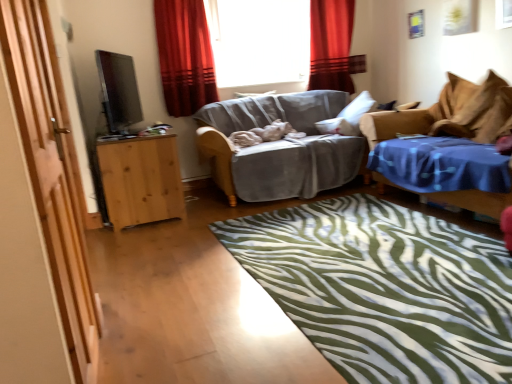
The height and width of the screenshot is (384, 512). Describe the element at coordinates (280, 146) in the screenshot. I see `gray fabric couch at center, positioned as the 1th studio couch in left-to-right order` at that location.

The width and height of the screenshot is (512, 384). What do you see at coordinates (259, 41) in the screenshot?
I see `transparent glass window at center` at bounding box center [259, 41].

Identify the location of blue fabric studio couch at right, which ranks as the second studio couch in left-to-right order. (448, 147).

Describe the element at coordinates (185, 56) in the screenshot. I see `red velvet curtain at upper center, placed as the 1th curtain when sorted from front to back` at that location.

The image size is (512, 384). What do you see at coordinates (141, 180) in the screenshot?
I see `light brown wooden cabinet at left` at bounding box center [141, 180].

The image size is (512, 384). What are the coordinates of `light brown wooden cabinet at left` in the screenshot? It's located at (141, 180).

Find the location of `gray fabric couch at center, which is counted as the 2th studio couch, starting from the right`. gray fabric couch at center, which is counted as the 2th studio couch, starting from the right is located at coordinates (280, 146).

Does point (117, 70) lie behind point (310, 17)?

That is False.

From the image's perspective, is satin black tv at left above red velvet curtain at upper center, acting as the second curtain starting from the left?

No, from the image's perspective, satin black tv at left is not on top of red velvet curtain at upper center, acting as the second curtain starting from the left.

Are satin black tv at left and red velvet curtain at upper center, which is the 1th curtain from back to front, making contact?

No, satin black tv at left is not in contact with red velvet curtain at upper center, which is the 1th curtain from back to front.

Does satin black tv at left have a greater height compared to red velvet curtain at upper center, the 1th curtain positioned from the right?

In fact, satin black tv at left may be shorter than red velvet curtain at upper center, the 1th curtain positioned from the right.

Is red velvet curtain at upper center, placed as the 1th curtain when sorted from front to back, not close to blue fabric studio couch at right, which ranks as the second studio couch in left-to-right order?

Yes.

The image size is (512, 384). I want to click on the 2nd curtain positioned above the blue fabric studio couch at right, which ranks as the second studio couch in left-to-right order (from a real-world perspective), so click(x=185, y=56).

Is point (208, 103) less distant than point (376, 156)?

That is False.

Is the position of red velvet curtain at upper center, placed as the 1th curtain when sorted from front to back, less distant than that of blue fabric studio couch at right, the 1th studio couch from the right?

No, red velvet curtain at upper center, placed as the 1th curtain when sorted from front to back, is further to the viewer.

Which object is further away from the camera taking this photo, satin black tv at left or green zebra-patterned rug at center?

satin black tv at left is further away from the camera.

Is there a large distance between satin black tv at left and green zebra-patterned rug at center?

Absolutely, satin black tv at left is distant from green zebra-patterned rug at center.

Based on the photo, is satin black tv at left turned away from green zebra-patterned rug at center?

satin black tv at left does not have its back to green zebra-patterned rug at center.

Considering the sizes of objects satin black tv at left and green zebra-patterned rug at center in the image provided, who is wider, satin black tv at left or green zebra-patterned rug at center?

green zebra-patterned rug at center is wider.

Would you say light brown wooden cabinet at left is inside or outside satin black tv at left?

light brown wooden cabinet at left is spatially situated outside satin black tv at left.

From a real-world perspective, which is physically above, light brown wooden cabinet at left or satin black tv at left?

satin black tv at left is physically above.

Is point (117, 167) closer or farther from the camera than point (118, 56)?

Clearly, point (117, 167) is closer to the camera than point (118, 56).

Measure the distance between light brown wooden cabinet at left and satin black tv at left.

They are 3.75 feet apart.

Is blue fabric studio couch at right, the 1th studio couch from the right, with light brown wooden cabinet at left?

No, blue fabric studio couch at right, the 1th studio couch from the right, is not touching light brown wooden cabinet at left.

Considering the relative sizes of blue fabric studio couch at right, the 1th studio couch from the right, and light brown wooden cabinet at left in the image provided, is blue fabric studio couch at right, the 1th studio couch from the right, thinner than light brown wooden cabinet at left?

No, blue fabric studio couch at right, the 1th studio couch from the right, is not thinner than light brown wooden cabinet at left.

How different are the orientations of blue fabric studio couch at right, the 1th studio couch from the right, and light brown wooden cabinet at left in degrees?

The angular difference between blue fabric studio couch at right, the 1th studio couch from the right, and light brown wooden cabinet at left is 180 degrees.

Measure the distance between blue fabric studio couch at right, the 1th studio couch from the right, and light brown wooden cabinet at left.

6.86 feet.

Looking at this image, between wooden door at left and transparent glass window at center, which one has less height?

transparent glass window at center is shorter.

From the image's perspective, between wooden door at left and transparent glass window at center, which one is located above?

transparent glass window at center appears higher in the image.

Between wooden door at left and transparent glass window at center, which one appears on the left side from the viewer's perspective?

wooden door at left is more to the left.

What's the angular difference between wooden door at left and transparent glass window at center's facing directions?

They differ by 89.8 degrees in their facing directions.

Which studio couch is the 1st one when counting from the front of the red velvet curtain at upper center, positioned as the 2th curtain in front-to-back order? Please provide its 2D coordinates.

[(280, 146)]

Based on the photo, does red velvet curtain at upper center, which is the 1th curtain from back to front, come in front of gray fabric couch at center, positioned as the 1th studio couch in left-to-right order?

No.

Considering the positions of objects red velvet curtain at upper center, the 1th curtain positioned from the right, and gray fabric couch at center, which is counted as the 2th studio couch, starting from the right, in the image provided, who is more to the left, red velvet curtain at upper center, the 1th curtain positioned from the right, or gray fabric couch at center, which is counted as the 2th studio couch, starting from the right,?

gray fabric couch at center, which is counted as the 2th studio couch, starting from the right.

In order to click on open located below the red velvet curtain at upper center, the 1th curtain positioned from the right (from the image's perspective) in this screenshot , I will do `click(118, 91)`.

The image size is (512, 384). Find the location of `curtain that is the 1st one when counting backward from the blue fabric studio couch at right, which ranks as the second studio couch in left-to-right order`. curtain that is the 1st one when counting backward from the blue fabric studio couch at right, which ranks as the second studio couch in left-to-right order is located at coordinates (185, 56).

Looking at the image, which one is located further to gray fabric couch at center, which is counted as the 2th studio couch, starting from the right, transparent glass window at center or light brown wooden cabinet at left?

transparent glass window at center lies further to gray fabric couch at center, which is counted as the 2th studio couch, starting from the right, than the other object.

Looking at the image, which one is located further to red velvet curtain at upper center, placed as the 1th curtain when sorted from front to back, blue fabric studio couch at right, the 1th studio couch from the right, or red velvet curtain at upper center, which is the 1th curtain from back to front?

Based on the image, blue fabric studio couch at right, the 1th studio couch from the right, appears to be further to red velvet curtain at upper center, placed as the 1th curtain when sorted from front to back.

Looking at the image, which one is located further to red velvet curtain at upper center, which ranks as the second curtain in back-to-front order, red velvet curtain at upper center, the 1th curtain positioned from the right, or gray fabric couch at center, positioned as the 1th studio couch in left-to-right order?

red velvet curtain at upper center, the 1th curtain positioned from the right.

Estimate the real-world distances between objects in this image. Which object is further from gray fabric couch at center, positioned as the 1th studio couch in left-to-right order, red velvet curtain at upper center, the first curtain viewed from the left, or wooden door at left?

wooden door at left lies further to gray fabric couch at center, positioned as the 1th studio couch in left-to-right order, than the other object.

Which object lies nearer to the anchor point transparent glass window at center, light brown wooden cabinet at left or red velvet curtain at upper center, the first curtain viewed from the left?

red velvet curtain at upper center, the first curtain viewed from the left, is closer to transparent glass window at center.

From the image, which object appears to be nearer to satin black tv at left, gray fabric couch at center, which is counted as the 2th studio couch, starting from the right, or wooden door at left?

The object closer to satin black tv at left is gray fabric couch at center, which is counted as the 2th studio couch, starting from the right.

Considering their positions, is green zebra-patterned rug at center positioned further to light brown wooden cabinet at left than wooden door at left?

Among the two, wooden door at left is located further to light brown wooden cabinet at left.

Based on their spatial positions, is satin black tv at left or blue fabric studio couch at right, which ranks as the second studio couch in left-to-right order, closer to green zebra-patterned rug at center?

Based on the image, blue fabric studio couch at right, which ranks as the second studio couch in left-to-right order, appears to be nearer to green zebra-patterned rug at center.

This screenshot has width=512, height=384. Find the location of `curtain situated between satin black tv at left and gray fabric couch at center, positioned as the 1th studio couch in left-to-right order, from left to right`. curtain situated between satin black tv at left and gray fabric couch at center, positioned as the 1th studio couch in left-to-right order, from left to right is located at coordinates (185, 56).

Locate an element on the screen. window between green zebra-patterned rug at center and red velvet curtain at upper center, which is the 1th curtain from back to front, in the front-back direction is located at coordinates (259, 41).

Locate an element on the screen. Image resolution: width=512 pixels, height=384 pixels. table positioned between wooden door at left and gray fabric couch at center, which is counted as the 2th studio couch, starting from the right, from near to far is located at coordinates (141, 180).

At what (x,y) coordinates should I click in order to perform the action: click on screen door between light brown wooden cabinet at left and blue fabric studio couch at right, the 1th studio couch from the right. Please return your answer as a coordinate pair (x, y). This screenshot has width=512, height=384. Looking at the image, I should click on (52, 172).